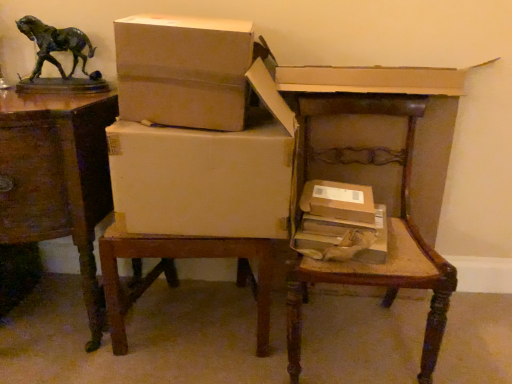
Where is `free spot above brown cardboard box at center, which is counted as the 3th box, starting from the top (from a real-world perspective)`? free spot above brown cardboard box at center, which is counted as the 3th box, starting from the top (from a real-world perspective) is located at coordinates (337, 193).